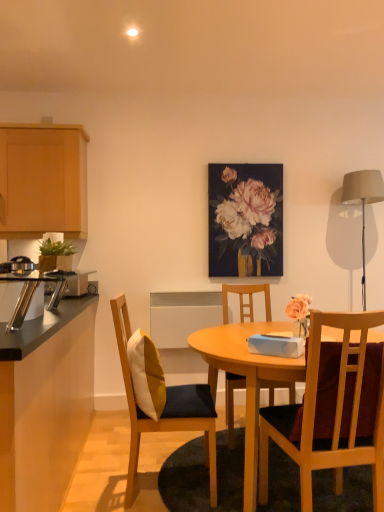
Question: In the image, is wooden chair at center, which is counted as the 3th chair, starting from the back, positioned in front of or behind satin silver toaster at left, placed as the 1th appliance when sorted from left to right?

Choices:
 (A) front
 (B) behind

Answer: (A)

Question: From a real-world perspective, is wooden chair at center, the 3th chair from the left, above or below satin silver toaster at left, arranged as the first appliance when viewed from the back?

Choices:
 (A) below
 (B) above

Answer: (A)

Question: Which of these objects is positioned closest to the matte gray lampshade at right?

Choices:
 (A) satin silver toaster at left, which is counted as the 2th appliance, starting from the front
 (B) floral bouquet at center
 (C) black laminate countertop at left, the 2th cabinetry from the top
 (D) green leafy plant at left
 (E) wooden chair at center, which is counted as the 2th chair, starting from the left

Answer: (B)

Question: Which object is the farthest from the wooden chair at center, the 3th chair from the left?

Choices:
 (A) white/yellow fabric pillow at center-left
 (B) matte gray lampshade at right
 (C) wooden chair with cushion at center, the 2th chair viewed from the back
 (D) metallic silver toaster at left, positioned as the second appliance in left-to-right order
 (E) black laminate countertop at left, the 2th cabinetry from the top

Answer: (B)